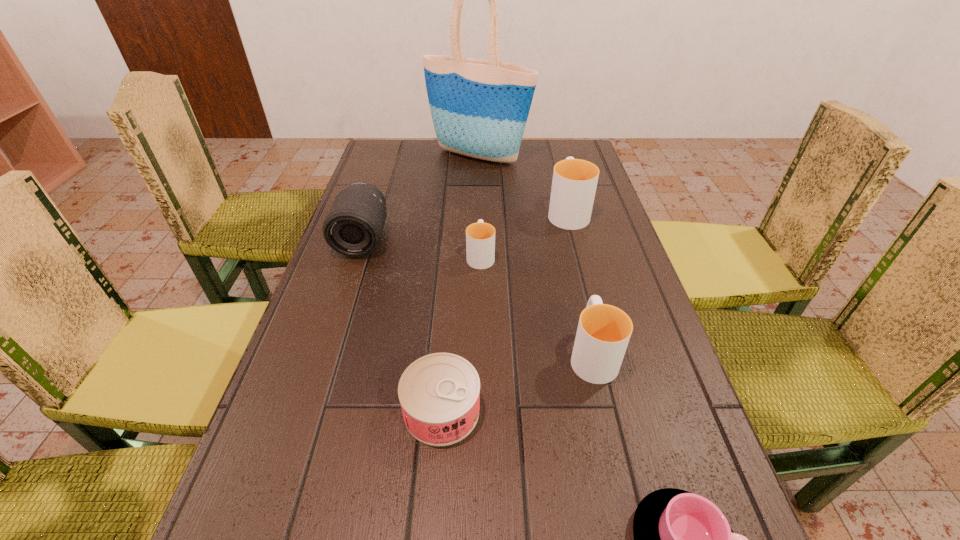
Identify the location of can. (439, 393).

The image size is (960, 540). Identify the location of blank space located 0.060m with the handle on the side of the biggest yellow cup. (561, 184).

This screenshot has width=960, height=540. In order to click on free space located with the handle on the side of the biggest yellow cup in this screenshot , I will do `click(554, 160)`.

The width and height of the screenshot is (960, 540). What are the coordinates of `vacant area situated with the handle on the side of the biggest yellow cup` in the screenshot? It's located at (554, 159).

The width and height of the screenshot is (960, 540). I want to click on vacant space positioned on the surface of the leftmost object, so click(x=349, y=279).

What are the coordinates of `free space located with the handle on the side of the nearest yellow cup` in the screenshot? It's located at (578, 294).

Image resolution: width=960 pixels, height=540 pixels. I want to click on free location located 0.360m with the handle on the side of the nearest yellow cup, so click(563, 227).

You are a GUI agent. You are given a task and a screenshot of the screen. Output one action in this format:
    pyautogui.click(x=<x>, y=<y>)
    Task: Click on the vacant space located with the handle on the side of the nearest yellow cup
    This screenshot has width=960, height=540.
    Given the screenshot: What is the action you would take?
    pyautogui.click(x=571, y=263)

The image size is (960, 540). In order to click on vacant space located with the handle on the side of the smallest yellow cup in this screenshot , I will do `click(481, 211)`.

Locate an element on the screen. This screenshot has height=540, width=960. free space located 0.110m with the handle on the side of the smallest yellow cup is located at coordinates (481, 218).